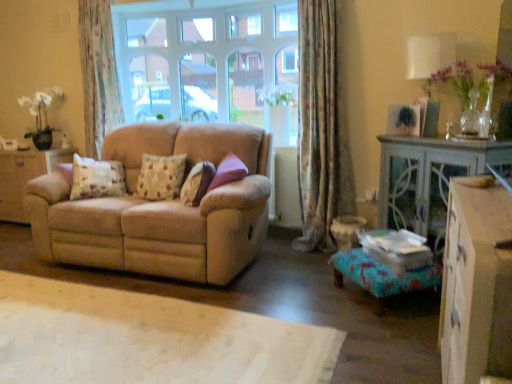
Question: From a real-world perspective, does white fabric lampshade at upper right sit lower than fluffy beige pillow at center, which is the 3th pillow in left-to-right order?

Choices:
 (A) no
 (B) yes

Answer: (A)

Question: Is white fabric lampshade at upper right bigger than fluffy beige pillow at center, the first pillow in the right-to-left sequence?

Choices:
 (A) yes
 (B) no

Answer: (A)

Question: Considering the relative sizes of white fabric lampshade at upper right and fluffy beige pillow at center, which is the 3th pillow in left-to-right order, in the image provided, is white fabric lampshade at upper right shorter than fluffy beige pillow at center, which is the 3th pillow in left-to-right order,?

Choices:
 (A) no
 (B) yes

Answer: (A)

Question: Does white fabric lampshade at upper right have a smaller size compared to fluffy beige pillow at center, the first pillow in the right-to-left sequence?

Choices:
 (A) yes
 (B) no

Answer: (B)

Question: Is fluffy beige pillow at center, the first pillow in the right-to-left sequence, a part of white fabric lampshade at upper right?

Choices:
 (A) no
 (B) yes

Answer: (A)

Question: Is white fabric lampshade at upper right at the left side of fluffy beige pillow at center, which is the 3th pillow in left-to-right order?

Choices:
 (A) yes
 (B) no

Answer: (B)

Question: Can you confirm if floral-patterned fabric pillow at left, which ranks as the 3th pillow in right-to-left order, is positioned to the left of fluffy beige pillow at center, the first pillow in the right-to-left sequence?

Choices:
 (A) no
 (B) yes

Answer: (B)

Question: Is the position of floral-patterned fabric pillow at left, which ranks as the 3th pillow in right-to-left order, more distant than that of fluffy beige pillow at center, the first pillow in the right-to-left sequence?

Choices:
 (A) no
 (B) yes

Answer: (B)

Question: Considering the relative sizes of floral-patterned fabric pillow at left, which is the first pillow from left to right, and fluffy beige pillow at center, which is the 3th pillow in left-to-right order, in the image provided, is floral-patterned fabric pillow at left, which is the first pillow from left to right, taller than fluffy beige pillow at center, which is the 3th pillow in left-to-right order,?

Choices:
 (A) yes
 (B) no

Answer: (A)

Question: From a real-world perspective, is floral-patterned fabric pillow at left, which ranks as the 3th pillow in right-to-left order, located higher than fluffy beige pillow at center, which is the 3th pillow in left-to-right order?

Choices:
 (A) yes
 (B) no

Answer: (B)

Question: Are floral-patterned fabric pillow at left, which ranks as the 3th pillow in right-to-left order, and fluffy beige pillow at center, which is the 3th pillow in left-to-right order, making contact?

Choices:
 (A) yes
 (B) no

Answer: (B)

Question: From a real-world perspective, is floral-patterned fabric pillow at left, which ranks as the 3th pillow in right-to-left order, positioned under fluffy beige pillow at center, which is the 3th pillow in left-to-right order, based on gravity?

Choices:
 (A) no
 (B) yes

Answer: (B)

Question: Can you confirm if white fabric lampshade at upper right is bigger than fluffy floral pillow at center, which is counted as the second pillow, starting from the left?

Choices:
 (A) yes
 (B) no

Answer: (A)